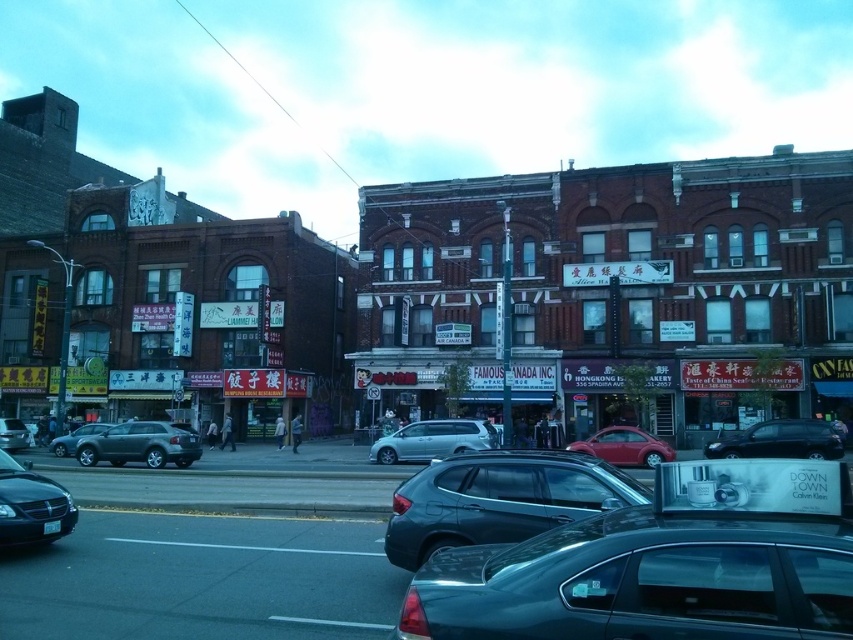
Can you confirm if satin black suv at center is smaller than satin silver car at center?

Actually, satin black suv at center might be larger than satin silver car at center.

Does point (415, 529) come farther from viewer compared to point (434, 433)?

No, (415, 529) is closer to viewer.

Does point (468, 512) come behind point (434, 420)?

No, (468, 512) is closer to viewer.

Where is `satin black suv at center`? satin black suv at center is located at coordinates (498, 499).

From the picture: Between matte black sedan at lower left and matte red car at center, which one is positioned higher?

matte black sedan at lower left is above.

You are a GUI agent. You are given a task and a screenshot of the screen. Output one action in this format:
    pyautogui.click(x=<x>, y=<y>)
    Task: Click on the matte black sedan at lower left
    The image size is (853, 640).
    Given the screenshot: What is the action you would take?
    pyautogui.click(x=32, y=506)

Who is more forward, (12, 512) or (674, 452)?

Point (12, 512)

Where is `matte black sedan at lower left`? The height and width of the screenshot is (640, 853). matte black sedan at lower left is located at coordinates (32, 506).

Who is more forward, (x=764, y=397) or (x=544, y=470)?

Positioned in front is point (x=544, y=470).

Who is shorter, brown brick building at center or satin black suv at center?

Standing shorter between the two is satin black suv at center.

Between point (289, 241) and point (514, 452), which one is positioned in front?

Point (514, 452)

In order to click on brown brick building at center in this screenshot , I will do [x=466, y=298].